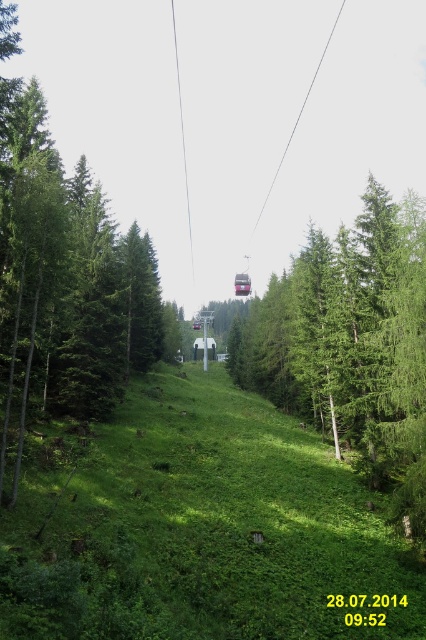
Question: Which of the following is the closest to the observer?

Choices:
 (A) green matte tree at center
 (B) green leafy tree at center

Answer: (A)

Question: Is green matte tree at center to the left of green leafy tree at center from the viewer's perspective?

Choices:
 (A) no
 (B) yes

Answer: (B)

Question: Which point is farther to the camera?

Choices:
 (A) green leafy tree at center
 (B) green matte tree at center

Answer: (A)

Question: Does green matte tree at center appear over green leafy tree at center?

Choices:
 (A) no
 (B) yes

Answer: (B)

Question: Which point is farther to the camera?

Choices:
 (A) green matte tree at center
 (B) green leafy tree at center

Answer: (B)

Question: Is green matte tree at center below green leafy tree at center?

Choices:
 (A) no
 (B) yes

Answer: (A)